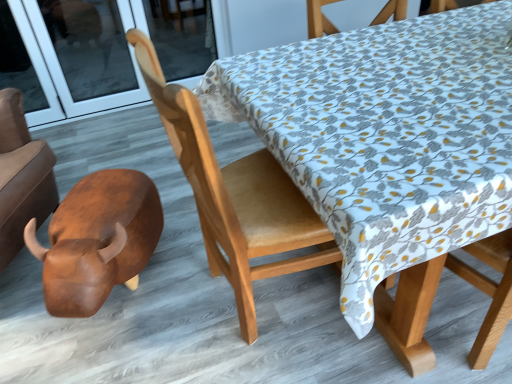
What do you see at coordinates (97, 240) in the screenshot? I see `brown polished wood bull at lower left` at bounding box center [97, 240].

The width and height of the screenshot is (512, 384). Describe the element at coordinates (236, 196) in the screenshot. I see `light brown wood chair at center` at that location.

At what (x,y) coordinates should I click in order to perform the action: click on brown polished wood bull at lower left. Please return your answer as a coordinate pair (x, y). Looking at the image, I should click on (97, 240).

From the picture: Is brown polished wood bull at lower left taller than light brown wood chair at center?

In fact, brown polished wood bull at lower left may be shorter than light brown wood chair at center.

Which of these two, brown polished wood bull at lower left or light brown wood chair at center, is wider?

brown polished wood bull at lower left.

Who is smaller, brown polished wood bull at lower left or light brown wood chair at center?

Smaller between the two is brown polished wood bull at lower left.

Measure the distance from brown polished wood bull at lower left to light brown wood chair at center.

They are 42.91 centimeters apart.

From the image's perspective, between transparent glass door at upper left and light brown wood chair at center, who is located below?

light brown wood chair at center.

Are transparent glass door at upper left and light brown wood chair at center making contact?

No, transparent glass door at upper left is not beside light brown wood chair at center.

How different are the orientations of transparent glass door at upper left and light brown wood chair at center in degrees?

The angle between the facing direction of transparent glass door at upper left and the facing direction of light brown wood chair at center is 93.3 degrees.

Between transparent glass door at upper left and light brown wood chair at center, which one has more height?

Standing taller between the two is light brown wood chair at center.

Where is `screen door that appears above the brown polished wood bull at lower left (from the image's perspective)`? screen door that appears above the brown polished wood bull at lower left (from the image's perspective) is located at coordinates (106, 51).

Is transparent glass door at upper left taller than brown polished wood bull at lower left?

Correct, transparent glass door at upper left is much taller as brown polished wood bull at lower left.

From a real-world perspective, is transparent glass door at upper left over brown polished wood bull at lower left?

Yes, from a real-world perspective, transparent glass door at upper left is on top of brown polished wood bull at lower left.

From the image's perspective, relative to brown polished wood bull at lower left, is transparent glass door at upper left above or below?

Clearly, from the image's perspective, transparent glass door at upper left is above brown polished wood bull at lower left.

Is point (230, 180) farther from viewer compared to point (205, 51)?

No, it is not.

Is the depth of light brown wood chair at center less than that of transparent glass door at upper left?

Yes, it is.

Considering the sizes of objects light brown wood chair at center and transparent glass door at upper left in the image provided, who is taller, light brown wood chair at center or transparent glass door at upper left?

light brown wood chair at center is taller.

Identify the location of chair in front of the transparent glass door at upper left. (236, 196).

How many degrees apart are the facing directions of brown polished wood bull at lower left and transparent glass door at upper left?

They differ by 28.7 degrees in their facing directions.

Is point (106, 260) positioned behind point (141, 26)?

Yes, it is behind point (141, 26).

Is brown polished wood bull at lower left at the right side of transparent glass door at upper left?

Yes.

Find the location of a particular element. screen door behind the brown polished wood bull at lower left is located at coordinates (106, 51).

Can you tell me how much light brown wood chair at center and brown polished wood bull at lower left differ in facing direction?

122 degrees separate the facing orientations of light brown wood chair at center and brown polished wood bull at lower left.

Which is in front, point (245, 308) or point (48, 262)?

The point (48, 262) is closer to the camera.

Is light brown wood chair at center far from brown polished wood bull at lower left?

No, light brown wood chair at center is not far from brown polished wood bull at lower left.

Is light brown wood chair at center looking in the opposite direction of brown polished wood bull at lower left?

Yes.

In order to click on animal lying on the left of light brown wood chair at center in this screenshot , I will do [x=97, y=240].

Identify the location of screen door that appears behind the light brown wood chair at center. The height and width of the screenshot is (384, 512). (106, 51).

Estimate the real-world distances between objects in this image. Which object is closer to light brown wood chair at center, brown polished wood bull at lower left or transparent glass door at upper left?

brown polished wood bull at lower left.

Which object lies further to the anchor point light brown wood chair at center, transparent glass door at upper left or brown polished wood bull at lower left?

Based on the image, transparent glass door at upper left appears to be further to light brown wood chair at center.

Looking at the image, which one is located closer to transparent glass door at upper left, brown polished wood bull at lower left or light brown wood chair at center?

brown polished wood bull at lower left.

Which object lies further to the anchor point brown polished wood bull at lower left, light brown wood chair at center or transparent glass door at upper left?

transparent glass door at upper left is positioned further to the anchor brown polished wood bull at lower left.

Estimate the real-world distances between objects in this image. Which object is closer to transparent glass door at upper left, light brown wood chair at center or brown polished wood bull at lower left?

brown polished wood bull at lower left lies closer to transparent glass door at upper left than the other object.

Consider the image. Considering their positions, is transparent glass door at upper left positioned further to brown polished wood bull at lower left than light brown wood chair at center?

Among the two, transparent glass door at upper left is located further to brown polished wood bull at lower left.

I want to click on animal positioned between light brown wood chair at center and transparent glass door at upper left from near to far, so click(97, 240).